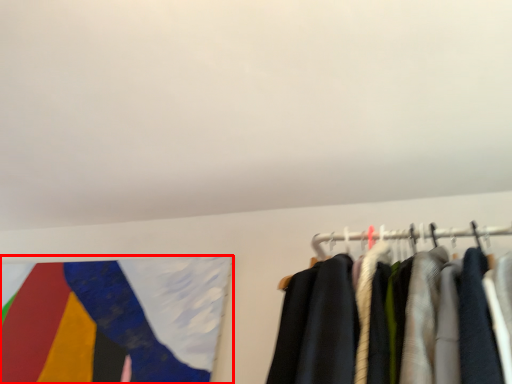
Question: From the image's perspective, where is flag (annotated by the red box) located in relation to backdrop in the image?

Choices:
 (A) below
 (B) above

Answer: (A)